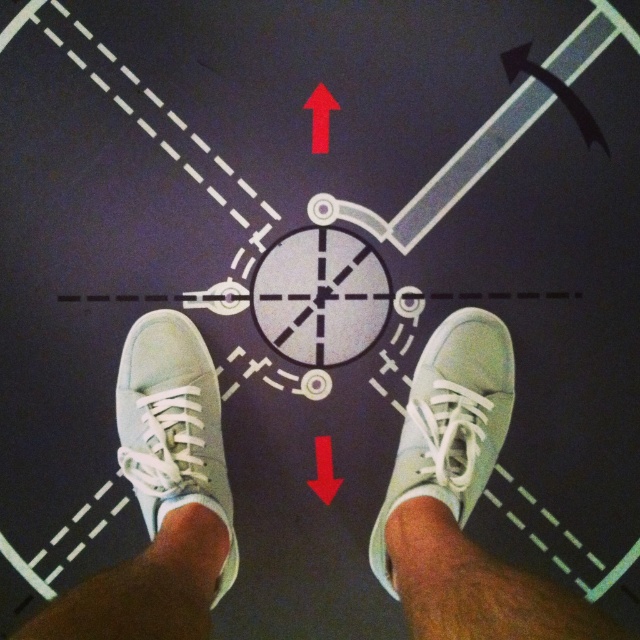
You are a delivery robot with a width of 20 centimeters. You need to move from your current position to the metallic gray circle at center while avoiding the red matte arrow at upper center. Can you fit through the space between them?

The distance between the metallic gray circle at center and the red matte arrow at upper center is 24.56 centimeters, which is wider than the robot width of 20 centimeters. Therefore, the robot can safely navigate through the space between them.